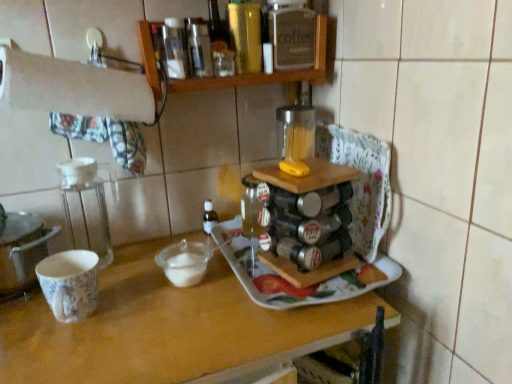
You are a GUI agent. You are given a task and a screenshot of the screen. Output one action in this format:
    pyautogui.click(x=<x>, y=<y>)
    Task: Click on the free space in front of porcelain floral mug at left
    The width and height of the screenshot is (512, 384).
    Given the screenshot: What is the action you would take?
    pyautogui.click(x=58, y=357)